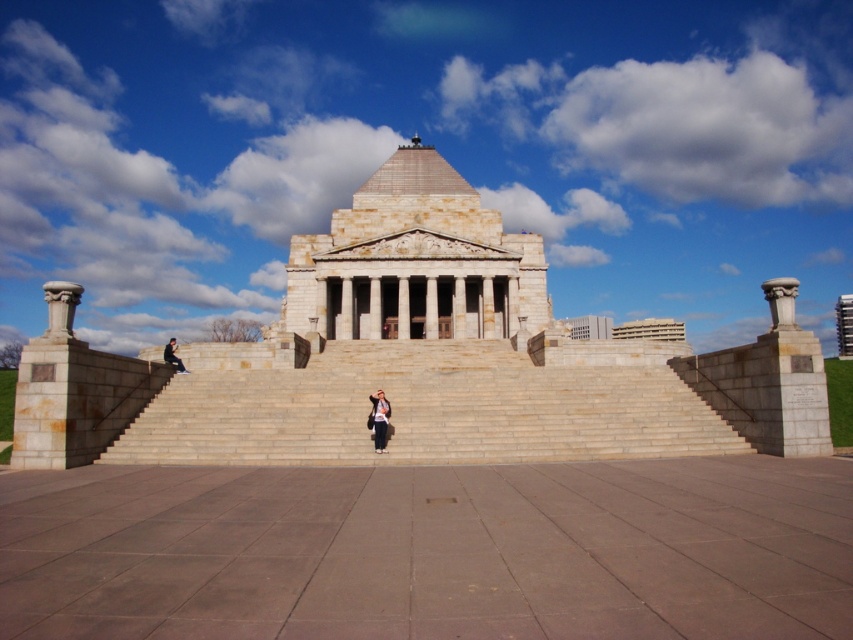
In the scene shown: You are planning to place a 2.5 meter wide decorative fountain in the plaza. The beige stone stairs at center and the white stone column at left are nearby. Which object has enough width to accommodate the fountain without overlapping?

The white stone column at left has a greater width than the beige stone stairs at center, so the fountain can be placed next to the white stone column at left without overlapping.

You are an architect designing a new monument and want to ensure that the columns are proportionate to the visitor amenities. Given the smooth stone column at right and the blurred denim jacket at lower left in the image, which object is narrower in width?

The smooth stone column at right is thinner than the blurred denim jacket at lower left, so the smooth stone column at right is narrower in width.